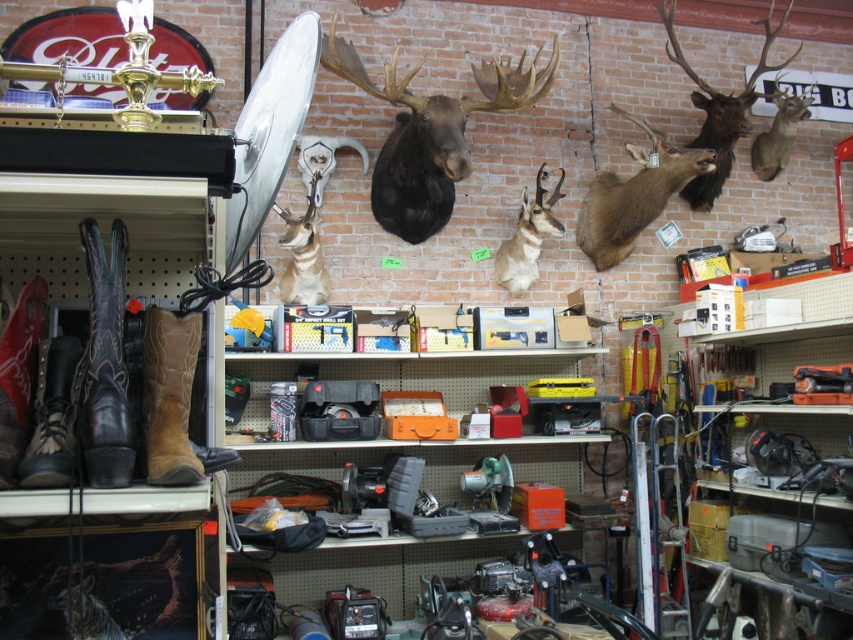
Question: Which point is closer to the camera?

Choices:
 (A) (625, 252)
 (B) (453, 141)

Answer: (B)

Question: Is black matte moose head at center above leather/cowhide cowboy boot at lower left?

Choices:
 (A) no
 (B) yes

Answer: (B)

Question: Which object is closer to the camera taking this photo?

Choices:
 (A) black leather boots at left
 (B) brown velvet deer at upper right
 (C) black matte moose head at center

Answer: (A)

Question: Which object is closer to the camera taking this photo?

Choices:
 (A) black leather boots at left
 (B) brown matte antelope at center
 (C) brown velvet deer at upper right
 (D) brown velvet deer head at upper right

Answer: (A)

Question: Does leather/cowhide cowboy boot at lower left appear over brown velvet deer at upper right?

Choices:
 (A) no
 (B) yes

Answer: (A)

Question: Is leather/cowhide cowboy boot at lower left behind red leather boot at left?

Choices:
 (A) yes
 (B) no

Answer: (B)